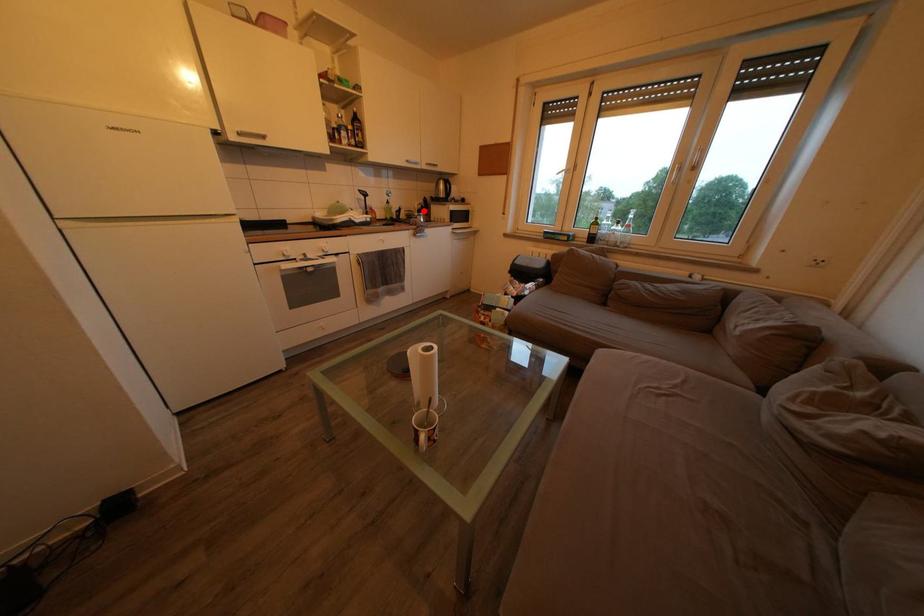
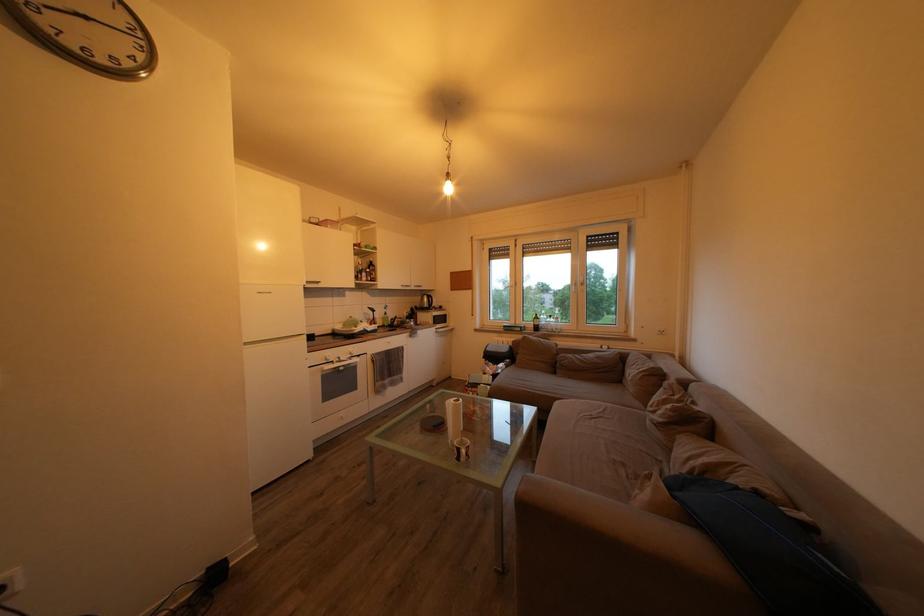
Question: A red point is marked in image1. In image2, is the corresponding 3D point closer to the camera or farther? Reply with the corresponding letter.

Choices:
 (A) The corresponding 3D point is closer.
 (B) The corresponding 3D point is farther.

Answer: (B)